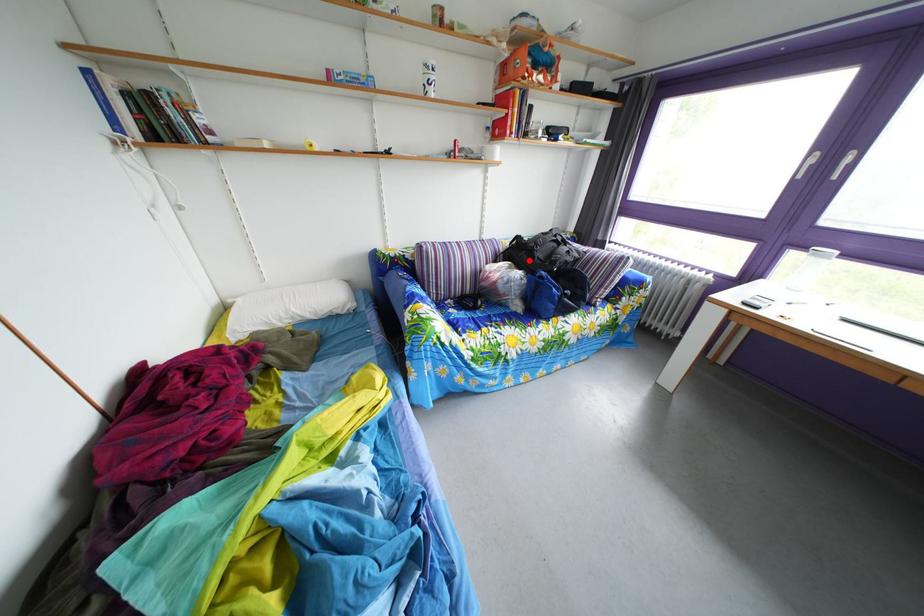
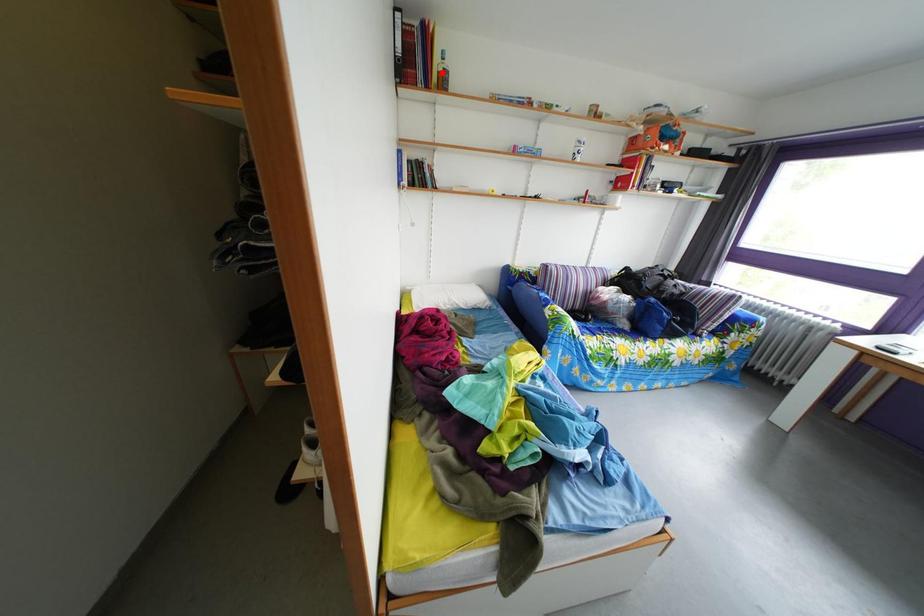
Consider the image. I am providing you with two images of the same scene from different viewpoints. A red point is marked on the first image and another point is marked on the second image. Is the red point in image1 aligned with the point shown in image2?

No